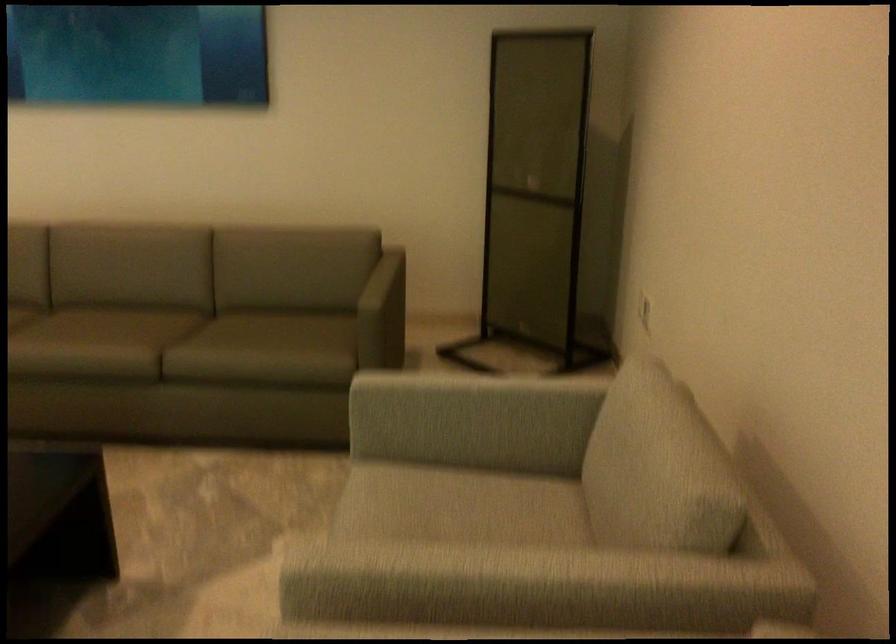
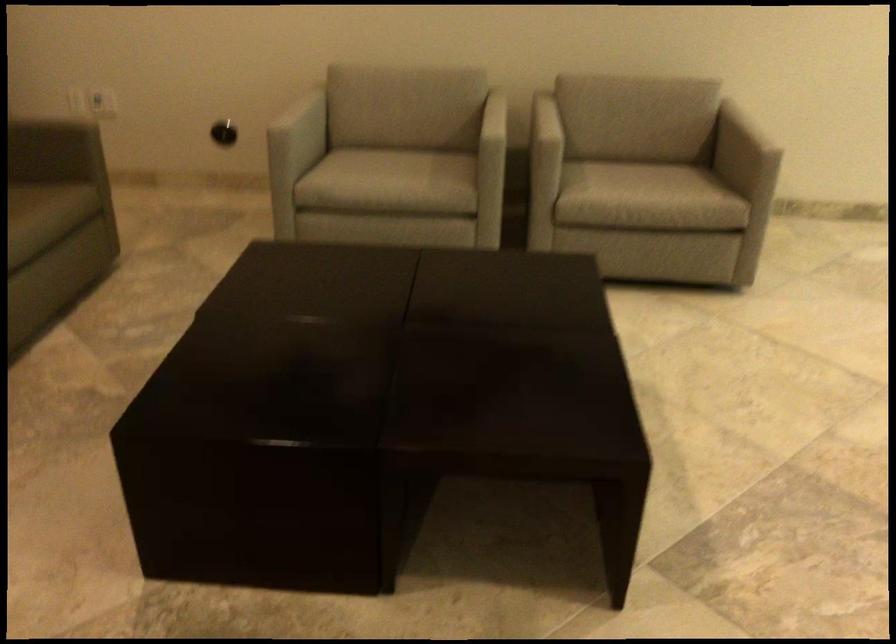
In the second image, find the point that corresponds to (x=540, y=433) in the first image.

(304, 124)